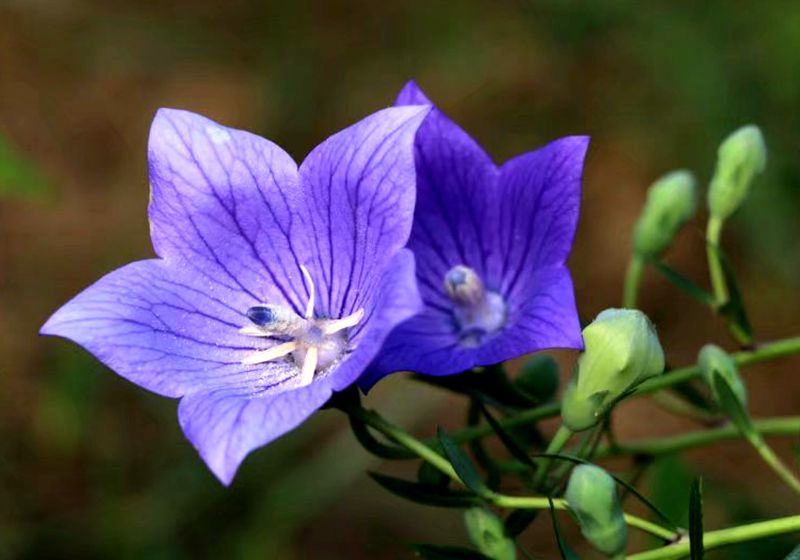
The image size is (800, 560). In order to click on bulbs in this screenshot , I will do `click(730, 180)`, `click(658, 208)`, `click(634, 358)`, `click(598, 520)`.